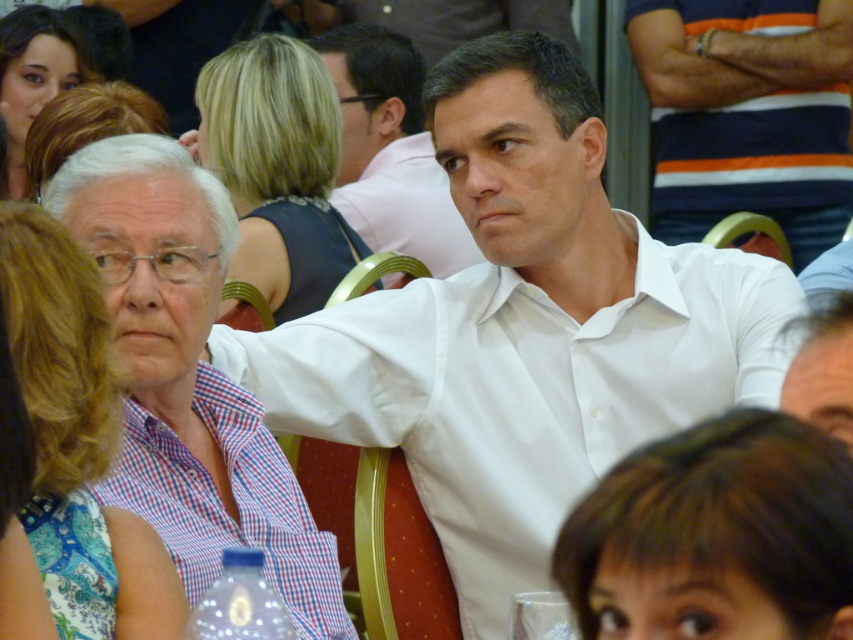
You are a photographer standing 10 feet away from the scene. You want to take a photo of the blonde hair at center and the blue floral dress at left. Can you fit both subjects into the frame without zooming in? Please explain your reasoning.

The blue floral dress at left is 6.08 feet from the blonde hair at center. Since the photographer is 10 feet away from the scene, the distance between the two subjects is less than the photographer distance, so both subjects can fit into the frame without zooming in.

You are an event planner trying to arrange seating for a photo. You see the white smooth shirt at center and the white shirt at center. Which one is positioned lower in the image?

The white smooth shirt at center is located below the white shirt at center, so the white smooth shirt at center is positioned lower in the image.